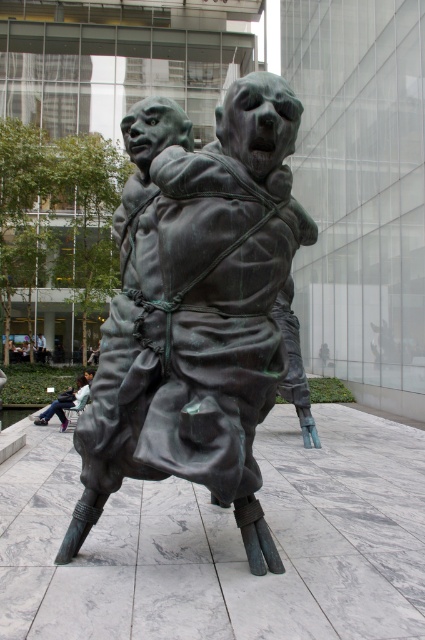
Is green patina bronze statue at center thinner than matte black jacket at lower left?

Incorrect, green patina bronze statue at center's width is not less than matte black jacket at lower left's.

Between green patina bronze statue at center and matte black jacket at lower left, which one has less height?

matte black jacket at lower left is shorter.

Between point (167, 220) and point (81, 385), which one is positioned in front?

Positioned in front is point (167, 220).

Identify the location of green patina bronze statue at center. (195, 307).